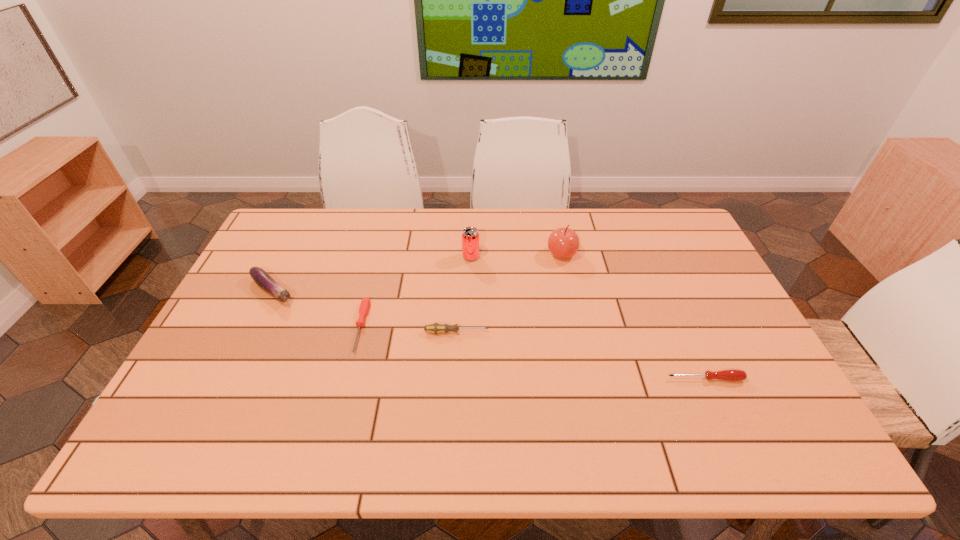
The image size is (960, 540). In order to click on the fifth object from left to right in this screenshot , I will do `click(563, 243)`.

Image resolution: width=960 pixels, height=540 pixels. Identify the location of soda can. (470, 236).

Locate an element on the screen. This screenshot has height=540, width=960. the leftmost object is located at coordinates 262,278.

Image resolution: width=960 pixels, height=540 pixels. In order to click on eggplant in this screenshot , I will do `click(262, 278)`.

Locate an element on the screen. the second screwdriver from left to right is located at coordinates (435, 328).

In order to click on the nearest object in this screenshot , I will do `click(732, 374)`.

Identify the location of the nearest screwdriver. (732, 374).

Where is `the shortest screwdriver`? the shortest screwdriver is located at coordinates (365, 303).

Locate an element on the screen. the leftmost screwdriver is located at coordinates [x=365, y=303].

Locate an element on the screen. The width and height of the screenshot is (960, 540). free space located 0.240m on the right of the apple is located at coordinates [x=650, y=254].